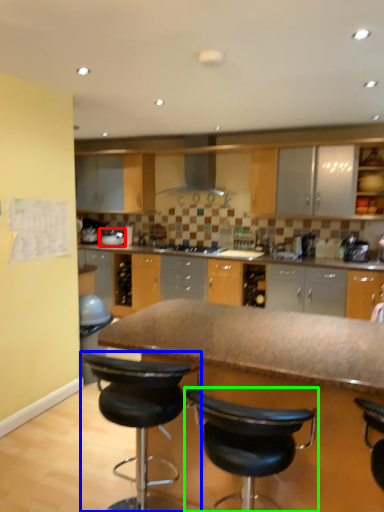
Question: Which is nearer to the appliance (highlighted by a red box)? chair (highlighted by a blue box) or chair (highlighted by a green box).

Choices:
 (A) chair
 (B) chair

Answer: (A)